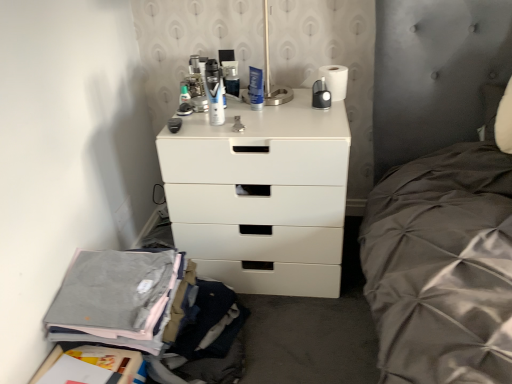
Where is `unoccupied area behind matte black shaving cream can at center, the second toiletry in the left-to-right sequence`? This screenshot has height=384, width=512. unoccupied area behind matte black shaving cream can at center, the second toiletry in the left-to-right sequence is located at coordinates (223, 111).